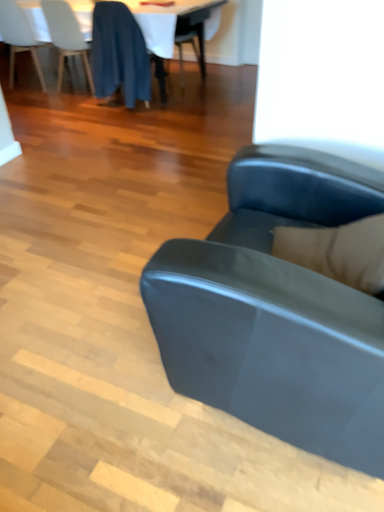
What do you see at coordinates (168, 21) in the screenshot? I see `white fabric table at upper center` at bounding box center [168, 21].

At what (x,y) coordinates should I click in order to perform the action: click on dark blue fabric at upper left, placed as the third chair when sorted from left to right. Please return your answer as a coordinate pair (x, y). This screenshot has width=384, height=512. Looking at the image, I should click on (117, 52).

Identify the location of matte black couch at center. This screenshot has height=512, width=384. (277, 310).

What do you see at coordinates (36, 18) in the screenshot? I see `white glossy table at upper center` at bounding box center [36, 18].

Where is `white matte chair at upper left, the 1th chair in the left-to-right sequence`? This screenshot has height=512, width=384. white matte chair at upper left, the 1th chair in the left-to-right sequence is located at coordinates (19, 37).

Is white glossy table at upper center not within dark blue fabric at upper left, placed as the third chair when sorted from left to right?

Yes, white glossy table at upper center is located beyond the bounds of dark blue fabric at upper left, placed as the third chair when sorted from left to right.

In the image, is white glossy table at upper center positioned in front of or behind dark blue fabric at upper left, which is the 1th chair in right-to-left order?

white glossy table at upper center is behind dark blue fabric at upper left, which is the 1th chair in right-to-left order.

From the image's perspective, is white glossy table at upper center positioned above or below dark blue fabric at upper left, which is the 1th chair in right-to-left order?

Based on their image positions, white glossy table at upper center is located above dark blue fabric at upper left, which is the 1th chair in right-to-left order.

Are matte black couch at center and white glossy table at upper center located far from each other?

Yes, matte black couch at center and white glossy table at upper center are quite far apart.

Locate an element on the screen. studio couch on the right of white glossy table at upper center is located at coordinates (277, 310).

In the scene shown: Is white glossy table at upper center inside matte black couch at center?

No, white glossy table at upper center is not inside matte black couch at center.

Consider the image. Considering the sizes of objects matte black couch at center and white glossy table at upper center in the image provided, who is smaller, matte black couch at center or white glossy table at upper center?

With smaller size is matte black couch at center.

Between white glossy table at upper center and white fabric table at upper center, which one has smaller width?

white glossy table at upper center is thinner.

Is white glossy table at upper center closer to camera compared to white fabric table at upper center?

No, white glossy table at upper center is further to the viewer.

The height and width of the screenshot is (512, 384). Identify the location of table in front of the white glossy table at upper center. (168, 21).

Is white fabric table at upper center inside the boundaries of white matte chair at upper left, the third chair positioned from the right, or outside?

white fabric table at upper center is spatially situated outside white matte chair at upper left, the third chair positioned from the right.

Considering the sizes of white fabric table at upper center and white matte chair at upper left, the 1th chair in the left-to-right sequence, in the image, is white fabric table at upper center wider or thinner than white matte chair at upper left, the 1th chair in the left-to-right sequence,?

In the image, white fabric table at upper center appears to be wider than white matte chair at upper left, the 1th chair in the left-to-right sequence.

Is white fabric table at upper center closer to camera compared to white matte chair at upper left, the 1th chair in the left-to-right sequence?

Yes, white fabric table at upper center is in front of white matte chair at upper left, the 1th chair in the left-to-right sequence.

You are a GUI agent. You are given a task and a screenshot of the screen. Output one action in this format:
    pyautogui.click(x=<x>, y=<y>)
    Task: Click on the studio couch below the white fabric table at upper center (from the image's perspective)
    The width and height of the screenshot is (384, 512).
    Given the screenshot: What is the action you would take?
    pyautogui.click(x=277, y=310)

Is matte black couch at center facing away from white fabric table at upper center?

matte black couch at center does not have its back to white fabric table at upper center.

From the image's perspective, relative to white fabric table at upper center, is matte black couch at center above or below?

Based on their image positions, matte black couch at center is located beneath white fabric table at upper center.

Considering the relative sizes of matte black couch at center and white fabric table at upper center in the image provided, is matte black couch at center smaller than white fabric table at upper center?

Yes, matte black couch at center is smaller than white fabric table at upper center.

Does white fabric table at upper center have a larger size compared to dark blue fabric at upper left, which is the 1th chair in right-to-left order?

Indeed, white fabric table at upper center has a larger size compared to dark blue fabric at upper left, which is the 1th chair in right-to-left order.

In the image, is white fabric table at upper center positioned in front of or behind dark blue fabric at upper left, which is the 1th chair in right-to-left order?

white fabric table at upper center is positioned farther from the viewer than dark blue fabric at upper left, which is the 1th chair in right-to-left order.

From the image's perspective, is white fabric table at upper center over dark blue fabric at upper left, placed as the third chair when sorted from left to right?

Yes.

Which of these two, white matte chair at upper left, the third chair positioned from the right, or dark blue fabric at upper left, which is the 1th chair in right-to-left order, is wider?

Wider between the two is white matte chair at upper left, the third chair positioned from the right.

From the picture: Which of these two, white matte chair at upper left, the third chair positioned from the right, or dark blue fabric at upper left, placed as the third chair when sorted from left to right, stands shorter?

white matte chair at upper left, the third chair positioned from the right.

Do you think white matte chair at upper left, the third chair positioned from the right, is within dark blue fabric at upper left, placed as the third chair when sorted from left to right, or outside of it?

white matte chair at upper left, the third chair positioned from the right, cannot be found inside dark blue fabric at upper left, placed as the third chair when sorted from left to right.

Can you tell me how much white matte chair at upper left, the 1th chair in the left-to-right sequence, and dark blue fabric at upper left, which is the 1th chair in right-to-left order, differ in facing direction?

white matte chair at upper left, the 1th chair in the left-to-right sequence, and dark blue fabric at upper left, which is the 1th chair in right-to-left order, are facing 0.182 degrees away from each other.

Identify the location of table top above the dark blue fabric at upper left, placed as the third chair when sorted from left to right (from a real-world perspective). (36, 18).

Image resolution: width=384 pixels, height=512 pixels. What are the coordinates of `studio couch below the white glossy table at upper center (from the image's perspective)` in the screenshot? It's located at (277, 310).

Considering their positions, is white fabric table at upper center positioned further to matte black couch at center than white glossy table at upper center?

white glossy table at upper center.

Considering their positions, is matte black couch at center positioned closer to blue fabric chair at upper left, the second chair from the left, than white matte chair at upper left, the 1th chair in the left-to-right sequence?

white matte chair at upper left, the 1th chair in the left-to-right sequence, is closer to blue fabric chair at upper left, the second chair from the left.

Which object lies nearer to the anchor point white fabric table at upper center, matte black couch at center or white matte chair at upper left, the third chair positioned from the right?

Based on the image, white matte chair at upper left, the third chair positioned from the right, appears to be nearer to white fabric table at upper center.

In the scene shown: Which object lies further to the anchor point white matte chair at upper left, the third chair positioned from the right, blue fabric chair at upper left, the second chair from the left, or white glossy table at upper center?

Among the two, blue fabric chair at upper left, the second chair from the left, is located further to white matte chair at upper left, the third chair positioned from the right.

Considering their positions, is dark blue fabric at upper left, which is the 1th chair in right-to-left order, positioned closer to blue fabric chair at upper left, the second chair from the left, than white matte chair at upper left, the third chair positioned from the right?

Based on the image, dark blue fabric at upper left, which is the 1th chair in right-to-left order, appears to be nearer to blue fabric chair at upper left, the second chair from the left.

Considering their positions, is matte black couch at center positioned closer to blue fabric chair at upper left, the second chair from the left, than white glossy table at upper center?

The object closer to blue fabric chair at upper left, the second chair from the left, is white glossy table at upper center.

Which object lies nearer to the anchor point dark blue fabric at upper left, which is the 1th chair in right-to-left order, white fabric table at upper center or white matte chair at upper left, the 1th chair in the left-to-right sequence?

white fabric table at upper center is positioned closer to the anchor dark blue fabric at upper left, which is the 1th chair in right-to-left order.

Based on their spatial positions, is dark blue fabric at upper left, which is the 1th chair in right-to-left order, or matte black couch at center further from white matte chair at upper left, the third chair positioned from the right?

matte black couch at center.

The width and height of the screenshot is (384, 512). Find the location of `chair between matte black couch at center and white fabric table at upper center along the z-axis`. chair between matte black couch at center and white fabric table at upper center along the z-axis is located at coordinates (117, 52).

I want to click on table located between white matte chair at upper left, the third chair positioned from the right, and dark blue fabric at upper left, which is the 1th chair in right-to-left order, in the left-right direction, so click(168, 21).

This screenshot has width=384, height=512. I want to click on table top between white matte chair at upper left, the third chair positioned from the right, and dark blue fabric at upper left, which is the 1th chair in right-to-left order, so click(36, 18).

Locate an element on the screen. table located between matte black couch at center and white matte chair at upper left, the third chair positioned from the right, in the depth direction is located at coordinates (168, 21).